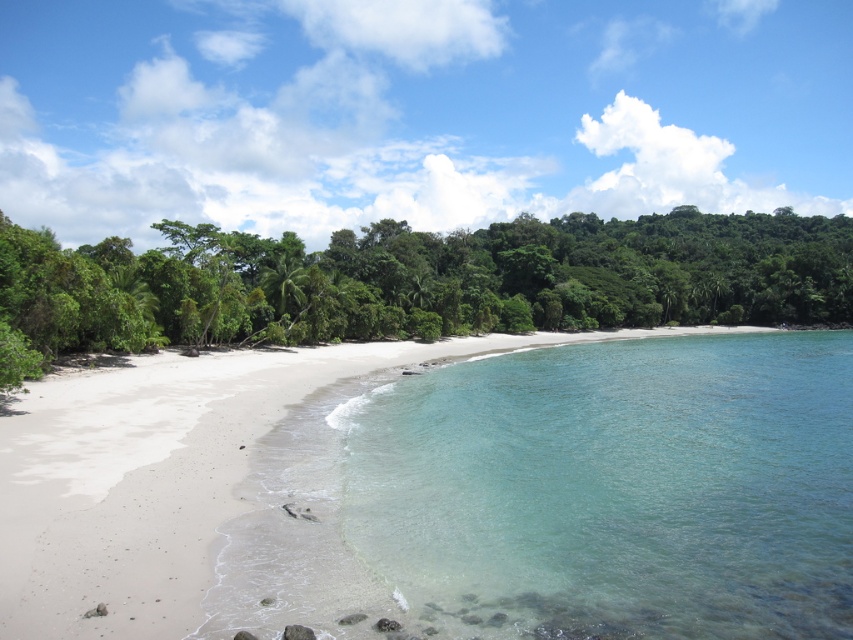
Question: Can you confirm if clear glassy water at center is thinner than green leafy trees at center?

Choices:
 (A) yes
 (B) no

Answer: (A)

Question: Is clear glassy water at center above green leafy trees at center?

Choices:
 (A) yes
 (B) no

Answer: (B)

Question: Which of the following is the farthest from the observer?

Choices:
 (A) (641, 259)
 (B) (428, 387)

Answer: (A)

Question: Which of the following is the closest to the observer?

Choices:
 (A) (740, 618)
 (B) (141, 260)

Answer: (A)

Question: Can you confirm if clear glassy water at center is wider than green leafy trees at center?

Choices:
 (A) yes
 (B) no

Answer: (B)